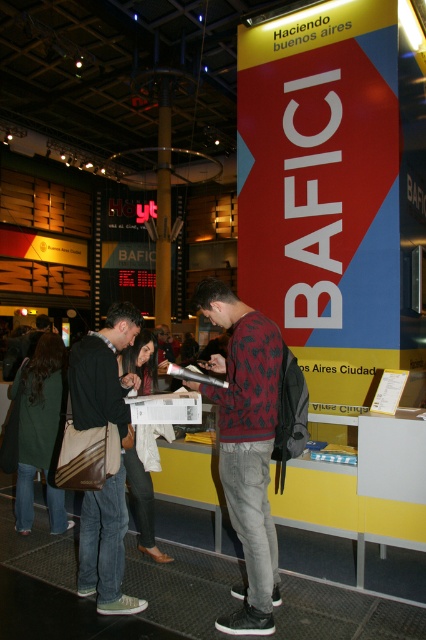
Question: Among these objects, which one is farthest from the camera?

Choices:
 (A) khaki canvas bag at center
 (B) white cotton shirt at center
 (C) dark green jacket at lower left

Answer: (C)

Question: Which of the following is the closest to the observer?

Choices:
 (A) red patterned sweater at center
 (B) khaki canvas bag at center
 (C) dark green jacket at lower left
 (D) white cotton shirt at center

Answer: (A)

Question: Does dark green jacket at lower left have a smaller size compared to white cotton shirt at center?

Choices:
 (A) no
 (B) yes

Answer: (A)

Question: Which point appears closest to the camera in this image?

Choices:
 (A) (250, 353)
 (B) (143, 339)
 (C) (31, 420)
 (D) (118, 346)

Answer: (A)

Question: Is red patterned sweater at center wider than dark green jacket at lower left?

Choices:
 (A) yes
 (B) no

Answer: (B)

Question: Can you confirm if khaki canvas bag at center is smaller than dark green jacket at lower left?

Choices:
 (A) yes
 (B) no

Answer: (B)